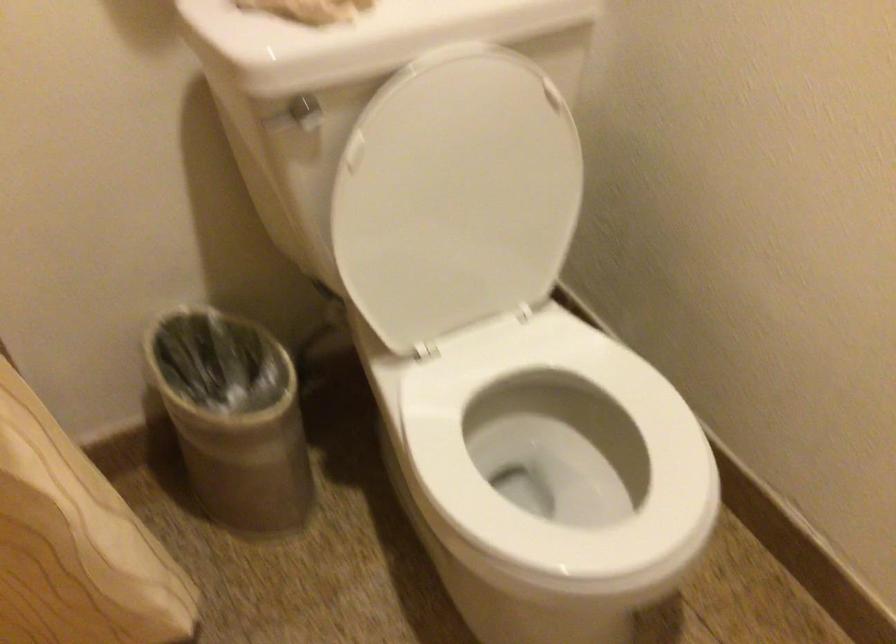
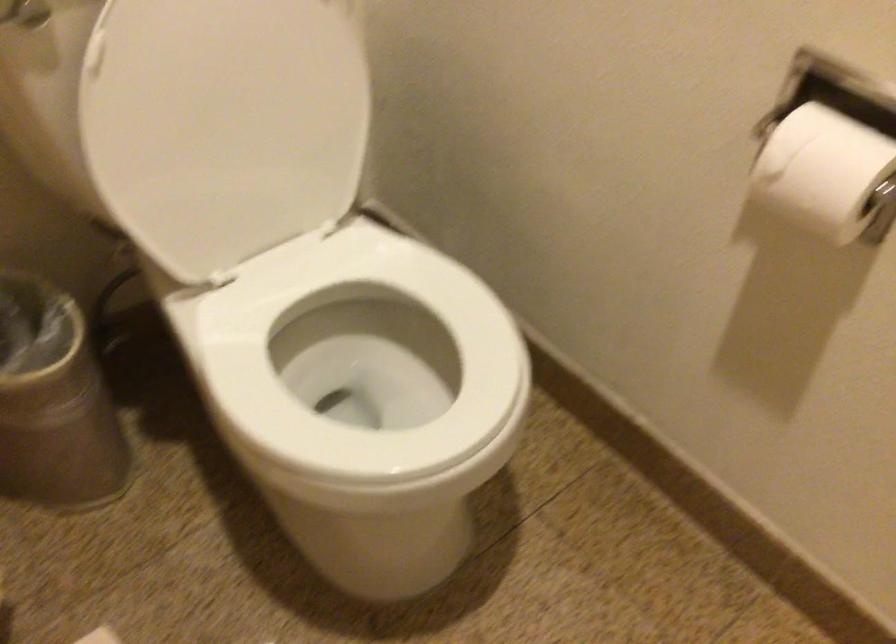
In the second image, find the point that corresponds to point 461,205 in the first image.

(239, 114)